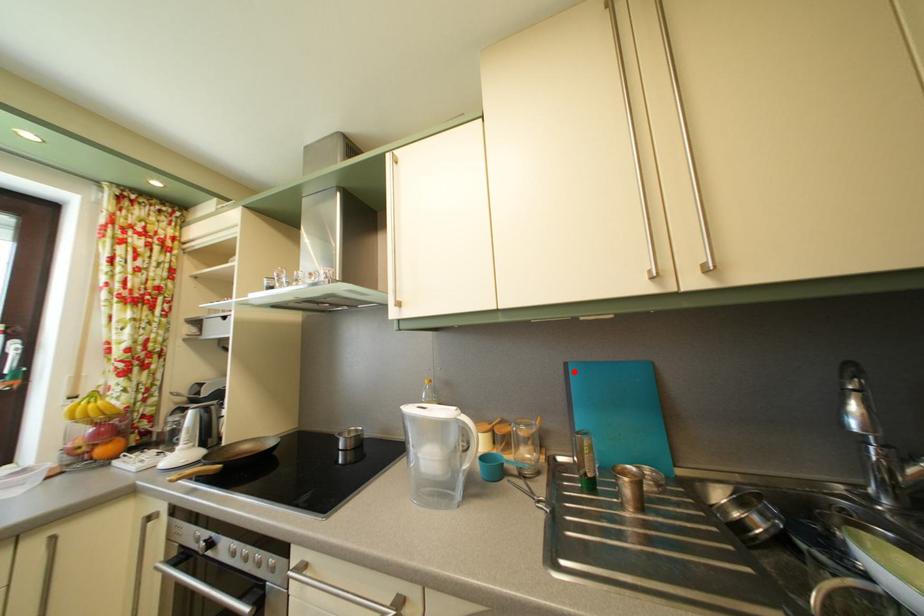
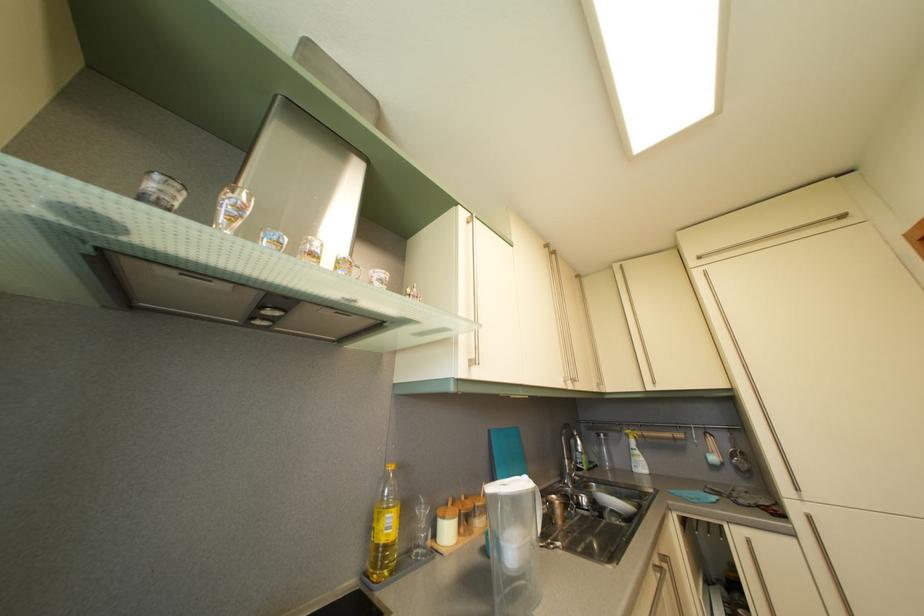
Question: I am providing you with two images of the same scene from different viewpoints. In image1, a red point is highlighted. Considering the same 3D point in image2, which of the following is correct?

Choices:
 (A) It is closer
 (B) It is farther

Answer: (B)